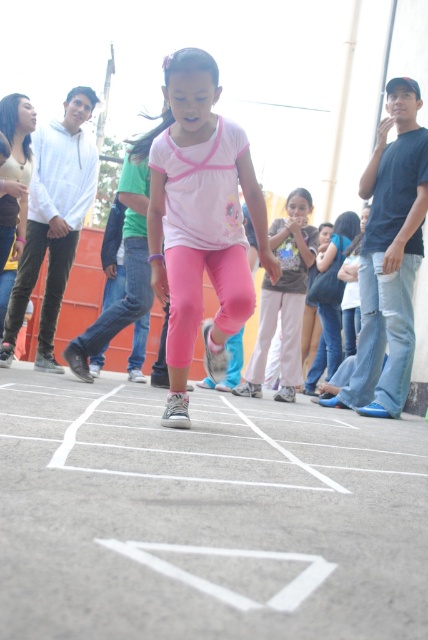
Question: Does pink fabric leggings at center appear under pink fabric pants at center?

Choices:
 (A) yes
 (B) no

Answer: (B)

Question: In this image, where is white painted lines at center located relative to pink matte leggings at center?

Choices:
 (A) left
 (B) right

Answer: (B)

Question: Does pink matte leggings at center have a smaller size compared to pink fabric leggings at upper left?

Choices:
 (A) no
 (B) yes

Answer: (A)

Question: Which point is closer to the camera taking this photo?

Choices:
 (A) (x=187, y=422)
 (B) (x=50, y=380)
 (C) (x=269, y=308)
 (D) (x=362, y=259)

Answer: (A)

Question: Which of the following is the closest to the observer?

Choices:
 (A) (169, 397)
 (B) (45, 209)

Answer: (A)

Question: Estimate the real-world distances between objects in this image. Which object is farther from the pink fabric leggings at upper left?

Choices:
 (A) pink fabric leggings at center
 (B) pink fabric pants at center

Answer: (A)